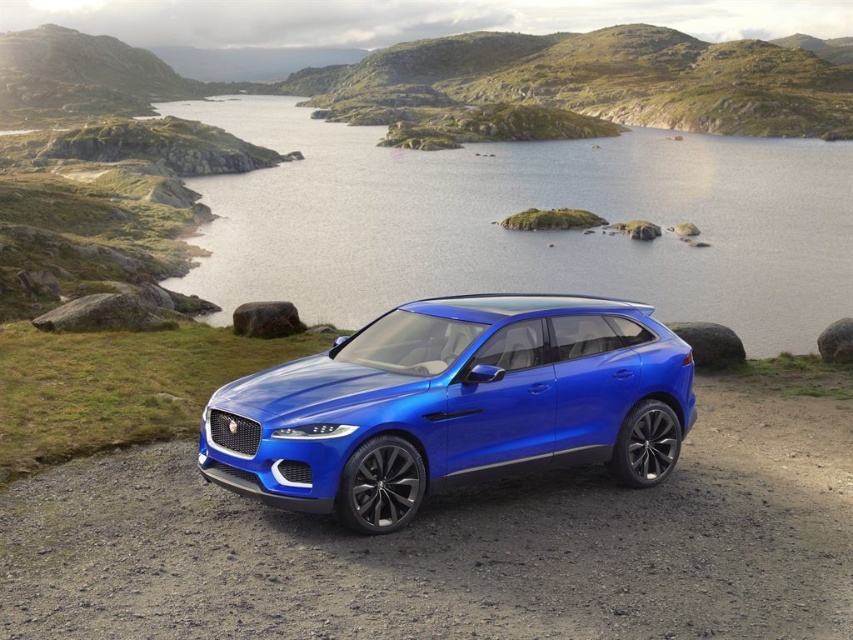
Which is more to the left, glossy blue water at center or shiny metallic blue suv at center?

From the viewer's perspective, glossy blue water at center appears more on the left side.

Who is higher up, glossy blue water at center or shiny metallic blue suv at center?

Positioned higher is glossy blue water at center.

Is point (524, 164) closer to camera compared to point (660, 392)?

No, it is behind (660, 392).

Where is `glossy blue water at center`? This screenshot has height=640, width=853. glossy blue water at center is located at coordinates (526, 232).